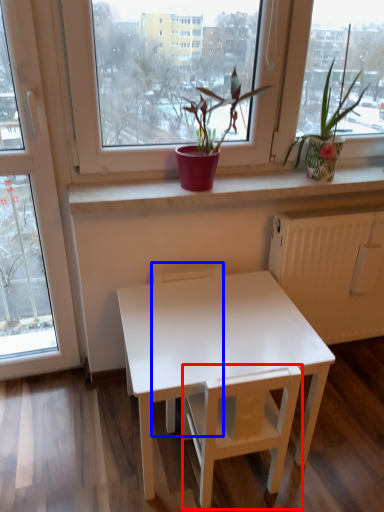
Question: Which object appears closest to the camera in this image, armchair (highlighted by a red box) or armchair (highlighted by a blue box)?

Choices:
 (A) armchair
 (B) armchair

Answer: (A)